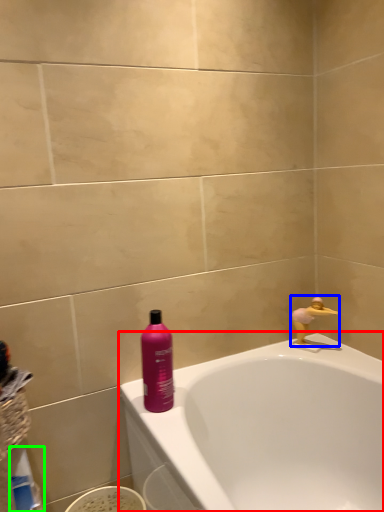
Question: Estimate the real-world distances between objects in this image. Which object is closer to bathtub (highlighted by a red box), faucet (highlighted by a blue box) or cleaning product (highlighted by a green box)?

Choices:
 (A) faucet
 (B) cleaning product

Answer: (A)